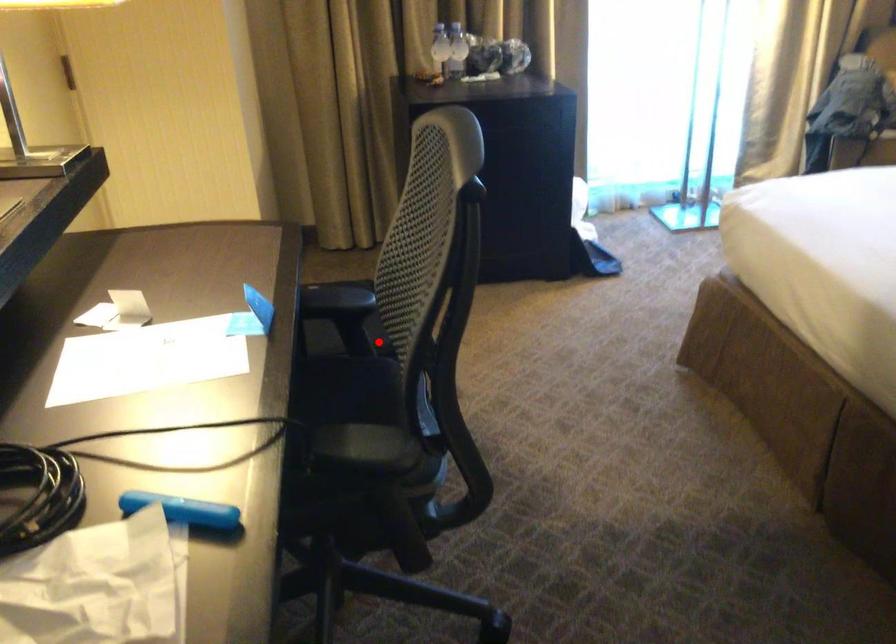
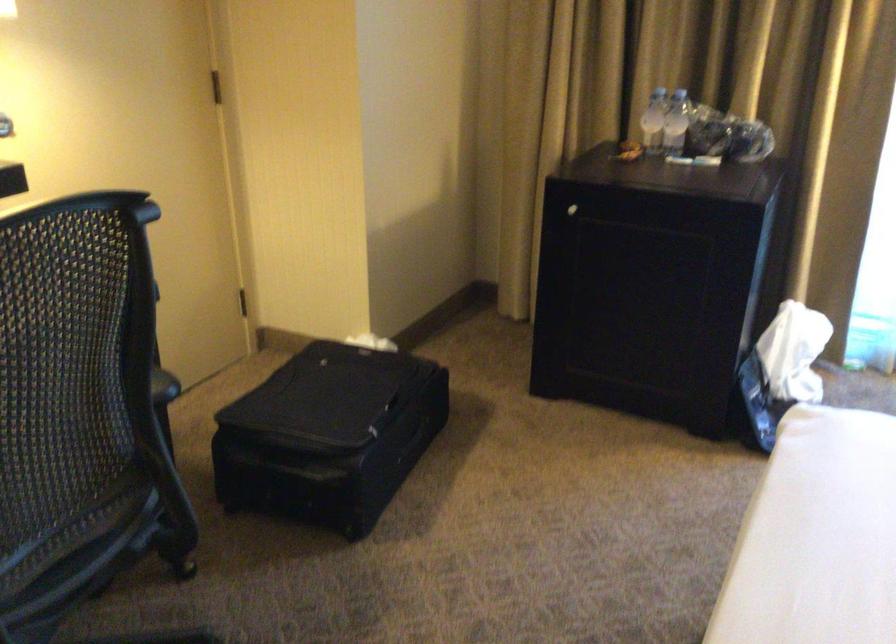
Question: I am providing you with two images of the same scene from different viewpoints. In image1, a red point is highlighted. Considering the same 3D point in image2, which of the following is correct?

Choices:
 (A) It is closer
 (B) It is farther

Answer: (A)